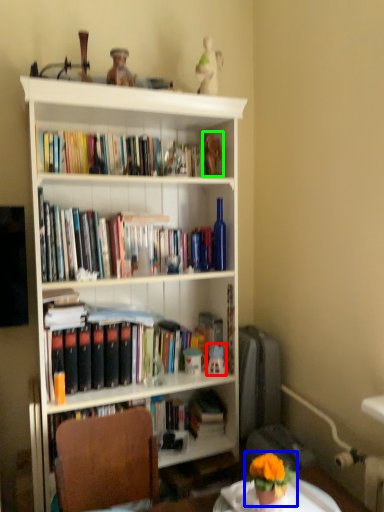
Question: Considering the real-world distances, which object is closest to toy (highlighted by a red box)? houseplant (highlighted by a blue box) or toy (highlighted by a green box).

Choices:
 (A) houseplant
 (B) toy

Answer: (A)